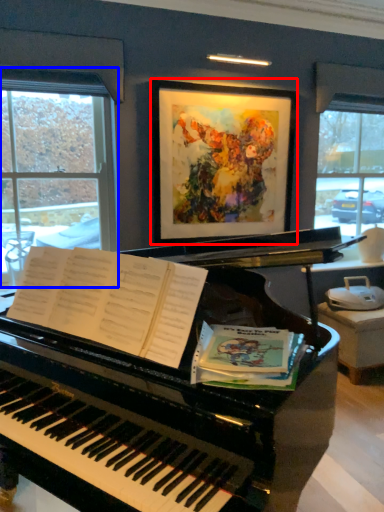
Question: Among these objects, which one is nearest to the camera, picture frame (highlighted by a red box) or window (highlighted by a blue box)?

Choices:
 (A) picture frame
 (B) window

Answer: (B)